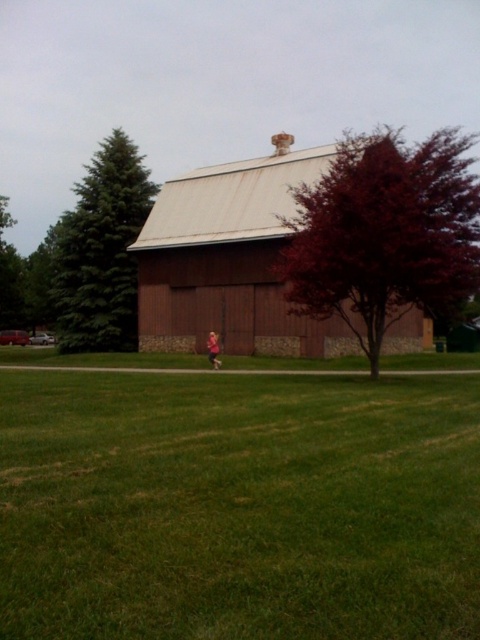
You are standing in front of the barn and want to place two markers at the coordinates point (410, 292) and point (205, 332). Which marker will be closer to you when placed?

Point (410, 292) is closer to the viewer than point (205, 332), so the marker at point (410, 292) will be closer to you.

In the scene shown: You are standing in front of the barn and want to plant a new flower bed between the green fir tree at left and the green leafy tree at left. Based on their widths, which tree should you place the flower bed closer to to ensure it doesn not get overshadowed?

The green fir tree at left might be wider than the green leafy tree at left, so the flower bed should be placed closer to the green leafy tree at left to avoid being overshadowed by the wider fir tree.